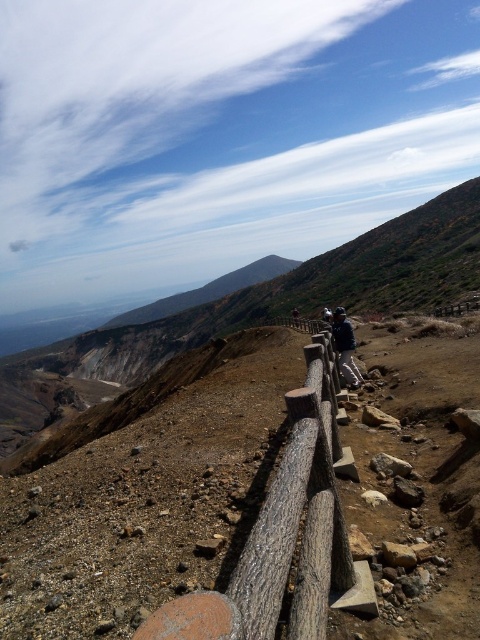
Is point (312, 364) in front of point (350, 336)?

Yes, point (312, 364) is in front of point (350, 336).

Identify the location of wooden log rail at center. (282, 532).